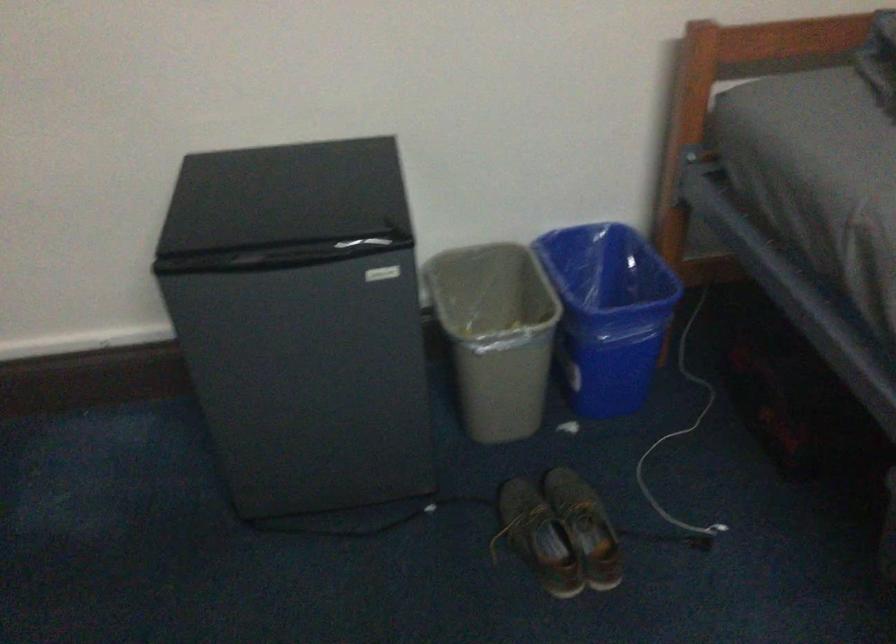
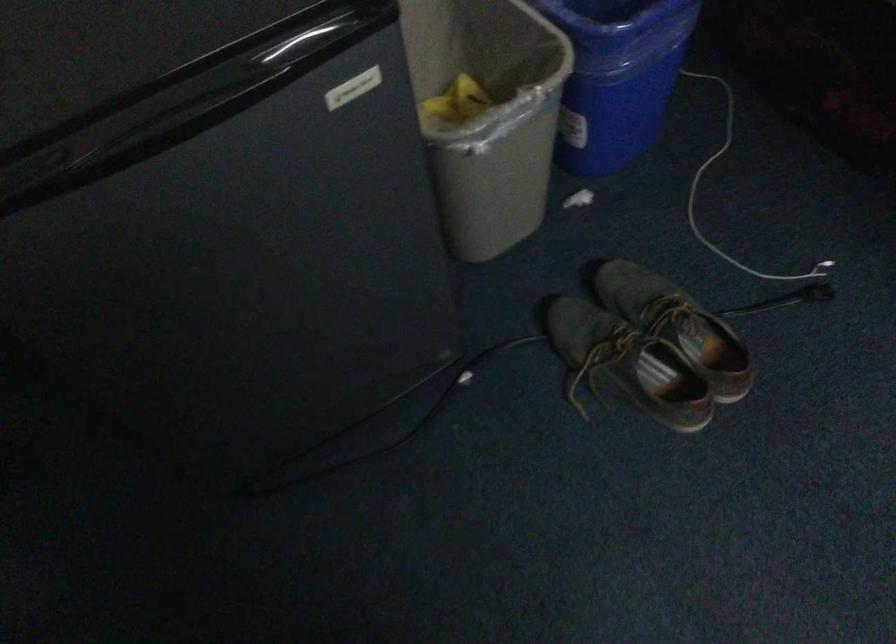
Locate, in the second image, the point that corresponds to the point at 599,345 in the first image.

(616, 76)